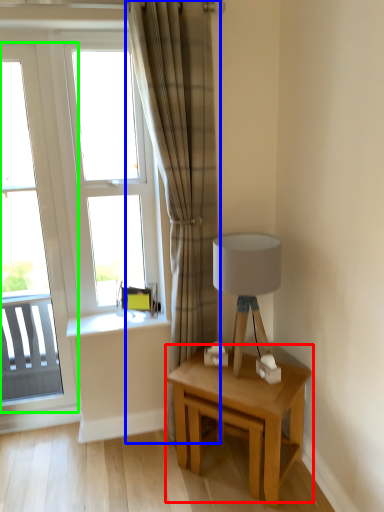
Question: Which object is the closest to the table (highlighted by a red box)? Choose among these: curtain (highlighted by a blue box) or window (highlighted by a green box).

Choices:
 (A) curtain
 (B) window

Answer: (A)